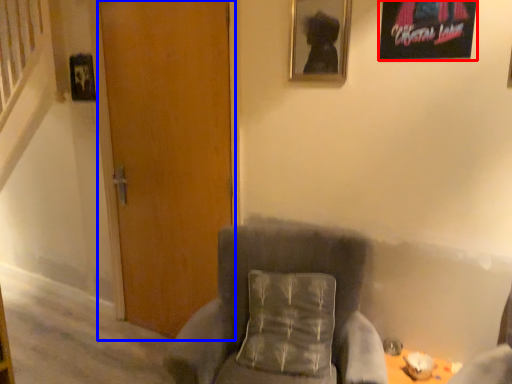
Question: Which object appears closest to the camera in this image, picture frame (highlighted by a red box) or door (highlighted by a blue box)?

Choices:
 (A) picture frame
 (B) door

Answer: (A)